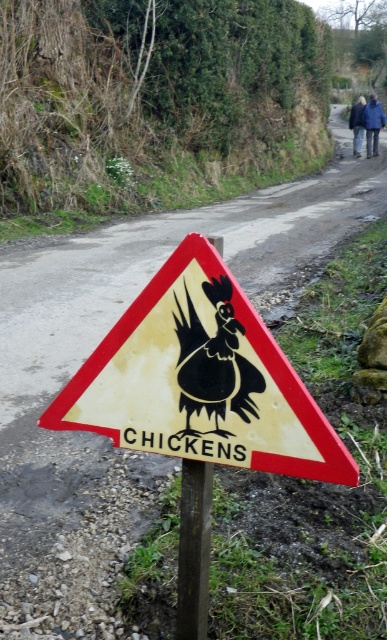
Question: Among these points, which one is farthest from the camera?

Choices:
 (A) (351, 120)
 (B) (369, 150)
 (C) (203, 592)

Answer: (A)

Question: Does yellow paper sign at center have a smaller size compared to blue fabric jacket at upper right?

Choices:
 (A) no
 (B) yes

Answer: (B)

Question: Estimate the real-world distances between objects in this image. Which object is closer to the brown wooden pole at center?

Choices:
 (A) blue fabric jacket at upper center
 (B) yellow paper sign at center

Answer: (B)

Question: Is blue fabric jacket at upper right smaller than blue fabric jacket at upper center?

Choices:
 (A) yes
 (B) no

Answer: (A)

Question: Is black glossy rooster at center bigger than blue fabric jacket at upper right?

Choices:
 (A) no
 (B) yes

Answer: (A)

Question: Based on their relative distances, which object is nearer to the brown wooden pole at center?

Choices:
 (A) yellow paper sign at center
 (B) blue fabric jacket at upper right
 (C) black glossy rooster at center
 (D) blue fabric jacket at upper center

Answer: (A)